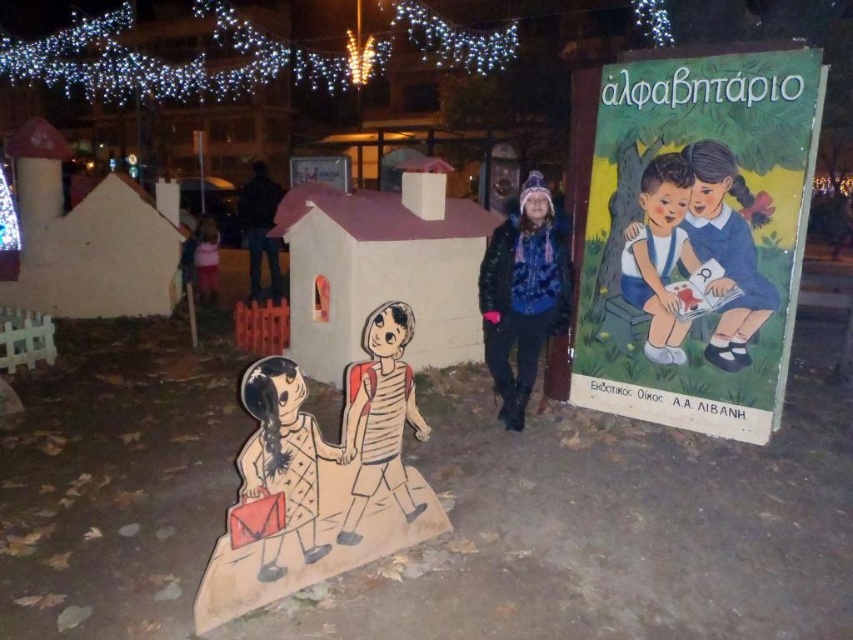
Does illuminated string lights at upper center appear over black leather jacket at center?

Indeed, illuminated string lights at upper center is positioned over black leather jacket at center.

Who is more forward, (492, 70) or (267, 204)?

Positioned in front is point (267, 204).

You are a GUI agent. You are given a task and a screenshot of the screen. Output one action in this format:
    pyautogui.click(x=<x>, y=<y>)
    Task: Click on the illuminated string lights at upper center
    The height and width of the screenshot is (640, 853).
    Given the screenshot: What is the action you would take?
    pyautogui.click(x=178, y=61)

Can you confirm if illuminated string lights at upper center is positioned below matte cardboard figure at center?

Actually, illuminated string lights at upper center is above matte cardboard figure at center.

Who is positioned more to the left, illuminated string lights at upper center or matte cardboard figure at center?

illuminated string lights at upper center

Image resolution: width=853 pixels, height=640 pixels. I want to click on illuminated string lights at upper center, so click(178, 61).

Where is `white paper child at center`? white paper child at center is located at coordinates (380, 417).

Is point (378, 390) closer to viewer compared to point (262, 204)?

Yes, it is in front of point (262, 204).

Between point (345, 428) and point (256, 221), which one is positioned behind?

Positioned behind is point (256, 221).

Where is `white paper child at center`? white paper child at center is located at coordinates (380, 417).